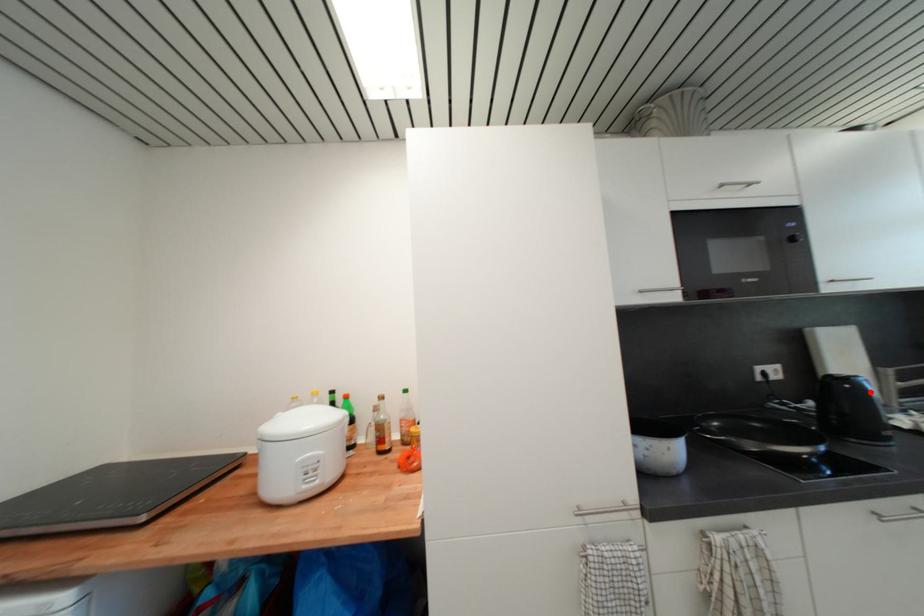
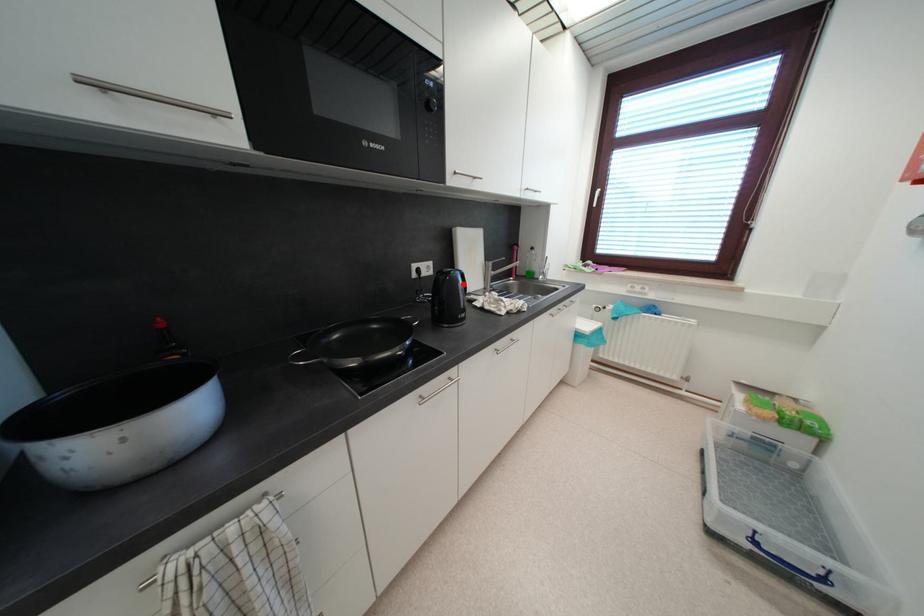
I am providing you with two images of the same scene from different viewpoints. A red point is marked on the first image and another point is marked on the second image. Are the points marked in image1 and image2 representing the same 3D position?

Yes